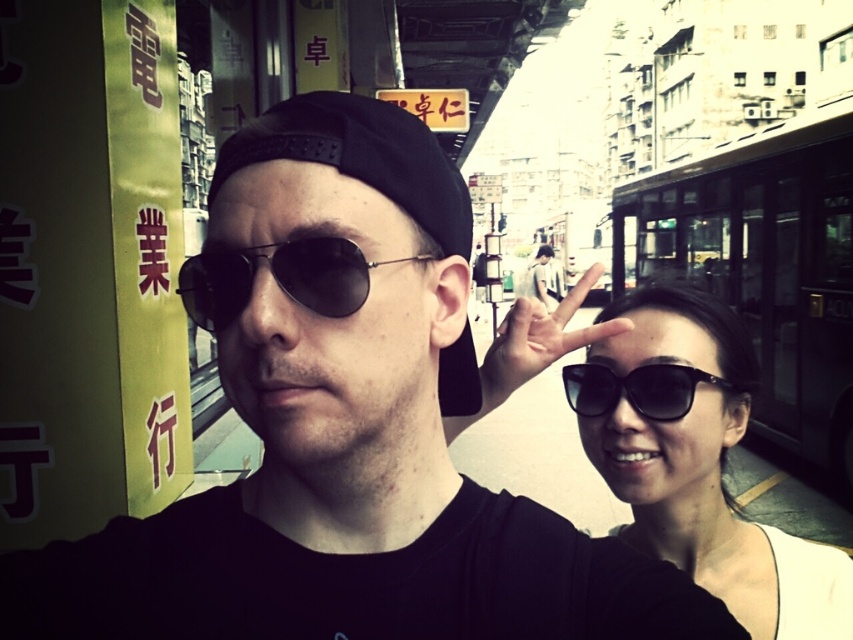
Question: Estimate the real-world distances between objects in this image. Which object is farther from the metallic round goggles at center?

Choices:
 (A) black matte hand at center
 (B) black matte sunglasses at right
 (C) black matte sunglasses at upper right

Answer: (C)

Question: Where is black matte sunglasses at upper right located in relation to black matte hand at center in the image?

Choices:
 (A) right
 (B) left

Answer: (A)

Question: Estimate the real-world distances between objects in this image. Which object is closer to the black matte sunglasses at upper right?

Choices:
 (A) metallic round goggles at center
 (B) black matte sunglasses at right

Answer: (B)

Question: Is metallic round goggles at center to the left of black matte sunglasses at right from the viewer's perspective?

Choices:
 (A) no
 (B) yes

Answer: (B)

Question: Based on their relative distances, which object is farther from the black matte sunglasses at upper right?

Choices:
 (A) black matte sunglasses at right
 (B) black matte hand at center
 (C) metallic round goggles at center

Answer: (C)

Question: Can you confirm if black matte sunglasses at upper right is positioned to the left of black matte sunglasses at right?

Choices:
 (A) yes
 (B) no

Answer: (B)